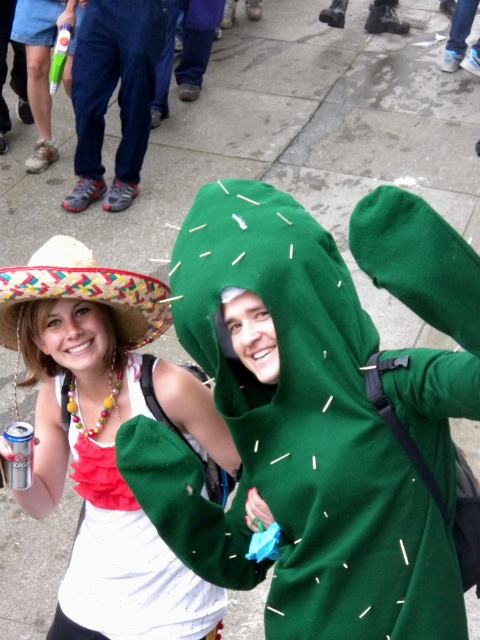
Question: Is bright yellow straw hat at lower left wider than silver metallic can at lower left?

Choices:
 (A) yes
 (B) no

Answer: (A)

Question: Which point appears farthest from the camera in this image?

Choices:
 (A) (58, 364)
 (B) (101, 298)
 (C) (19, 460)

Answer: (A)

Question: Does matte white tank top at center have a smaller size compared to silver metallic can at lower left?

Choices:
 (A) yes
 (B) no

Answer: (B)

Question: Which point is closer to the camera?

Choices:
 (A) (80, 289)
 (B) (168, 412)

Answer: (A)

Question: Which is farther from the matte white tank top at center?

Choices:
 (A) bright yellow straw hat at lower left
 (B) silver metallic can at lower left

Answer: (B)

Question: Is matte white tank top at center smaller than bright yellow straw hat at lower left?

Choices:
 (A) no
 (B) yes

Answer: (A)